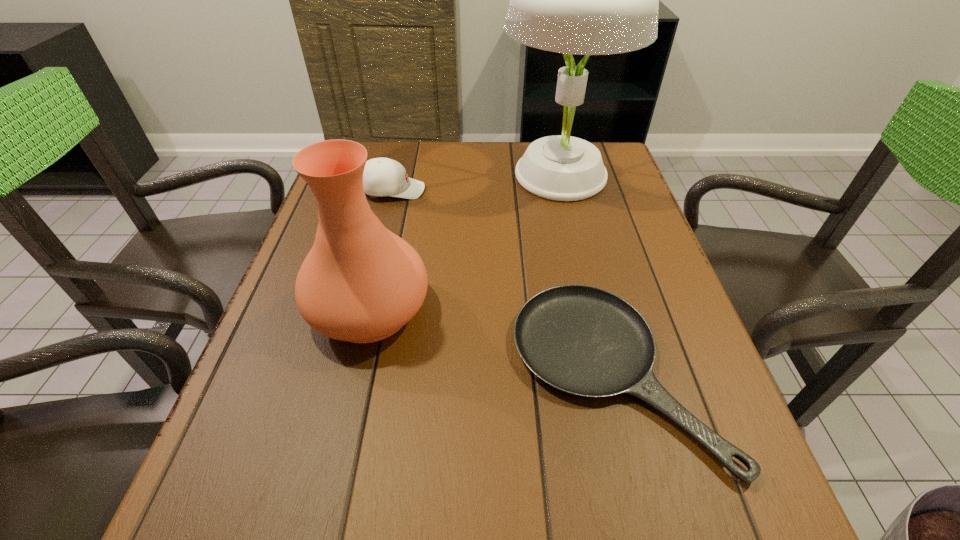
This screenshot has width=960, height=540. I want to click on vacant area that lies between the baseball cap and the frying pan, so click(503, 282).

The width and height of the screenshot is (960, 540). Identify the location of the second closest object to the lamp. (361, 283).

Identify which object is the third nearest to the baseball cap. Please provide its 2D coordinates. Your answer should be formatted as a tuple, i.e. [(x, y)], where the tuple contains the x and y coordinates of a point satisfying the conditions above.

[(582, 340)]

The height and width of the screenshot is (540, 960). I want to click on free space in the image that satisfies the following two spatial constraints: 1. on the front-facing side of the second tallest object; 2. on the right side of the third tallest object, so click(363, 309).

You are a GUI agent. You are given a task and a screenshot of the screen. Output one action in this format:
    pyautogui.click(x=<x>, y=<y>)
    Task: Click on the vacant space that satisfies the following two spatial constraints: 1. on the back side of the vase; 2. on the front-facing side of the third tallest object
    The width and height of the screenshot is (960, 540).
    Given the screenshot: What is the action you would take?
    pyautogui.click(x=397, y=190)

Find the location of `free point that satisfies the following two spatial constraints: 1. on the back side of the vase; 2. on the front-facing side of the baseball cap`. free point that satisfies the following two spatial constraints: 1. on the back side of the vase; 2. on the front-facing side of the baseball cap is located at coordinates (397, 190).

This screenshot has height=540, width=960. Find the location of `vacant region that satisfies the following two spatial constraints: 1. on the front-facing side of the second shortest object; 2. on the left side of the shortest object`. vacant region that satisfies the following two spatial constraints: 1. on the front-facing side of the second shortest object; 2. on the left side of the shortest object is located at coordinates (347, 373).

At what (x,y) coordinates should I click in order to perform the action: click on free space that satisfies the following two spatial constraints: 1. on the back side of the shortest object; 2. on the front-facing side of the tallest object. Please return your answer as a coordinate pair (x, y). The image size is (960, 540). Looking at the image, I should click on (564, 175).

Identify the location of free location that satisfies the following two spatial constraints: 1. on the back side of the shortest object; 2. on the front-facing side of the tallest object. The image size is (960, 540). (564, 175).

The width and height of the screenshot is (960, 540). What are the coordinates of `vacant space that satisfies the following two spatial constraints: 1. on the front-facing side of the third tallest object; 2. on the right side of the vase` in the screenshot? It's located at (363, 309).